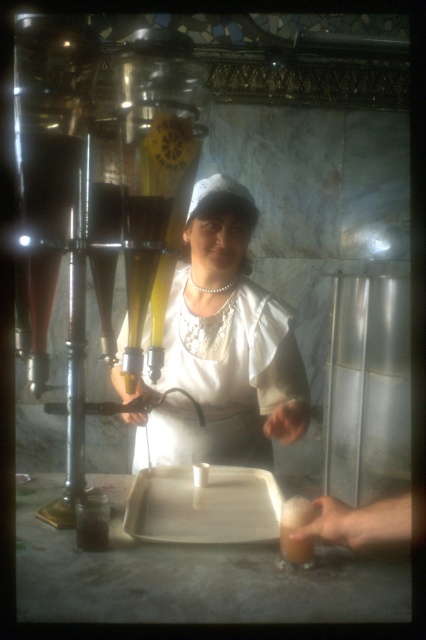
Question: Which of the following is the closest to the observer?

Choices:
 (A) (296, 557)
 (B) (267, 337)

Answer: (A)

Question: Which point is closer to the camera taking this photo?

Choices:
 (A) (275, 432)
 (B) (290, 548)

Answer: (B)

Question: Where is white fabric apron at center located in relation to translucent glass drink at lower center in the image?

Choices:
 (A) below
 (B) above

Answer: (B)

Question: Considering the relative positions of white fabric apron at center and translucent glass drink at lower center in the image provided, where is white fabric apron at center located with respect to translucent glass drink at lower center?

Choices:
 (A) left
 (B) right

Answer: (A)

Question: Does white fabric apron at center have a smaller size compared to translucent glass drink at lower center?

Choices:
 (A) yes
 (B) no

Answer: (B)